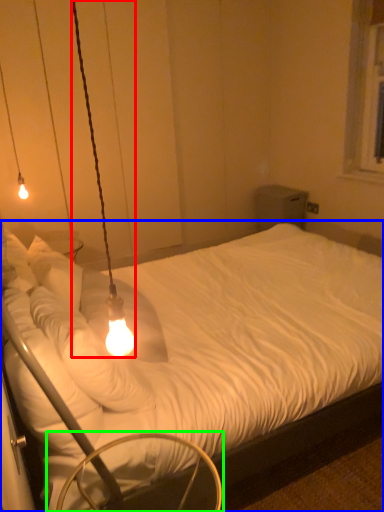
Question: Based on their relative distances, which object is farther from lamp (highlighted by a red box)? Choose from bed (highlighted by a blue box) and swivel chair (highlighted by a green box).

Choices:
 (A) bed
 (B) swivel chair

Answer: (A)